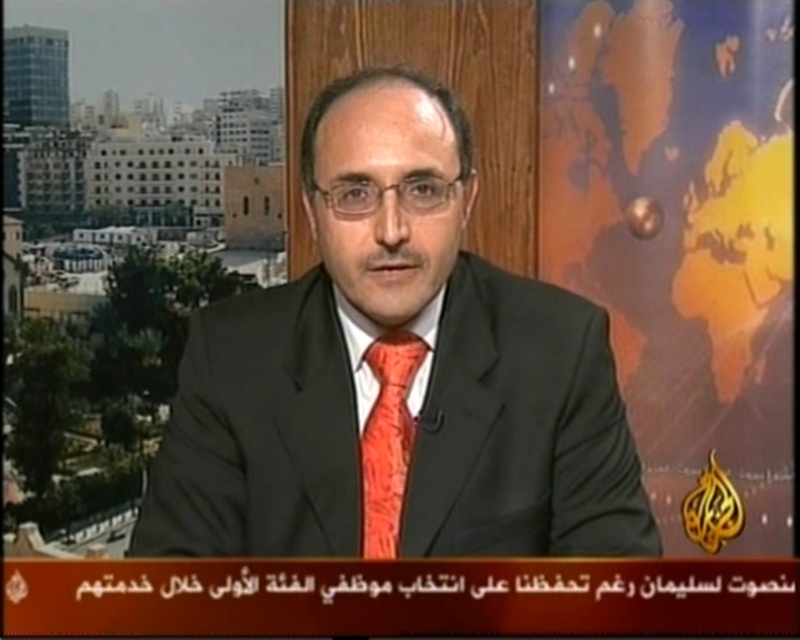
Question: Which point appears farthest from the camera in this image?

Choices:
 (A) (490, 440)
 (B) (433, 308)
 (C) (394, 422)

Answer: (C)

Question: Where is orange satin tie at center located in relation to matte orange dress shirt at center in the image?

Choices:
 (A) above
 (B) below

Answer: (B)

Question: Which point is farther to the camera?

Choices:
 (A) (396, 342)
 (B) (374, 460)

Answer: (B)

Question: Does matte black suit at center have a larger size compared to orange satin tie at center?

Choices:
 (A) yes
 (B) no

Answer: (A)

Question: Is orange satin tie at center behind matte orange dress shirt at center?

Choices:
 (A) yes
 (B) no

Answer: (A)

Question: Which object is the closest to the matte orange dress shirt at center?

Choices:
 (A) matte black suit at center
 (B) orange satin tie at center

Answer: (B)